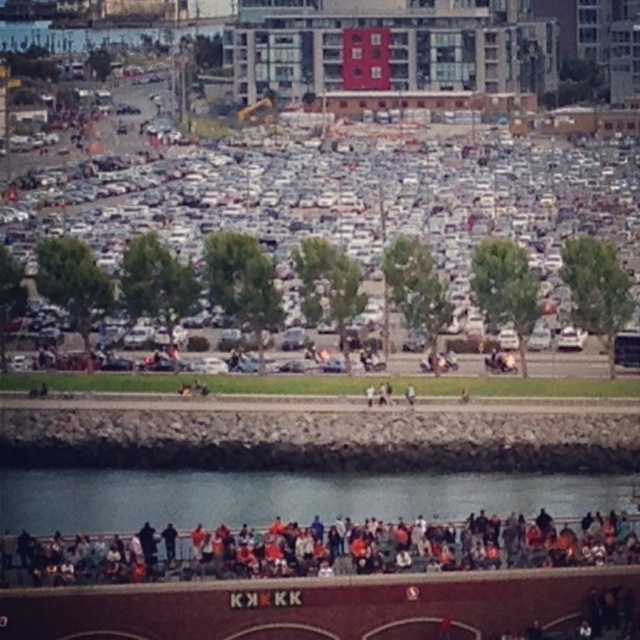
You are standing on the waterfront promenade and want to take a photo of the clear water at lower center without the orange fabric crowd at lower center blocking the view. Is this possible?

The orange fabric crowd at lower center is behind clear water at lower center, so you can take a photo of the clear water at lower center without the crowd blocking the view because the crowd is behind the water.